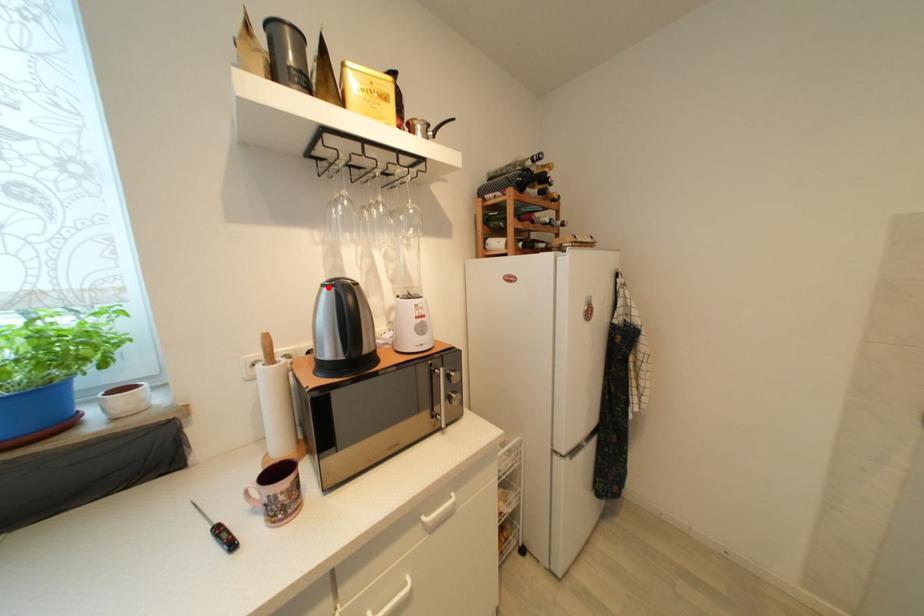
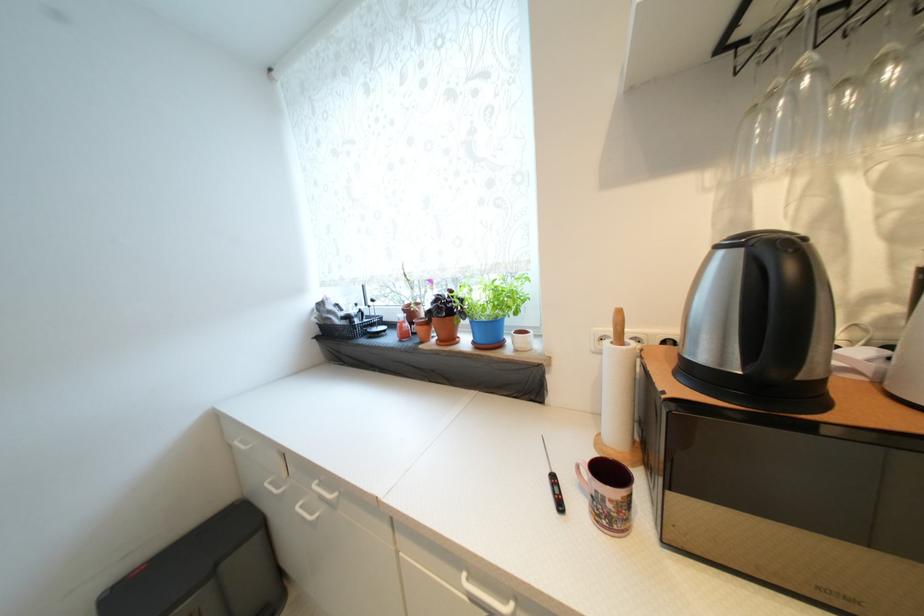
Where in the second image is the point corresponding to the highlighted location from the first image?

(723, 249)